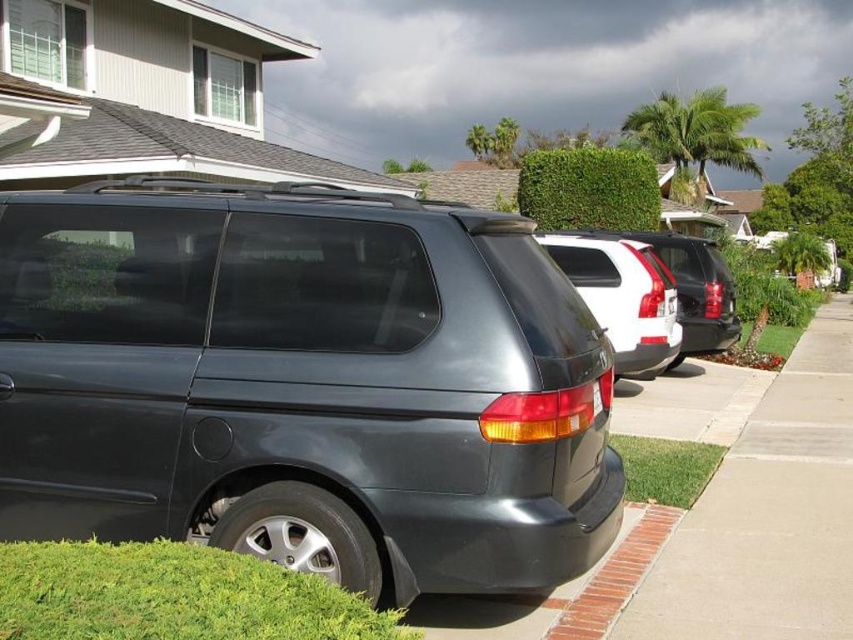
You are a delivery person standing at the sidewalk near the brick at lower right. You need to deliver a package to the white matte suv at center. Can you walk directly to the suv without crossing the street?

The white matte suv at center is 13.16 feet away from the brick at lower right. Since the sidewalk runs parallel to the street and the brick is part of the sidewalk border, you can walk directly to the white matte suv at center along the sidewalk without crossing the street.

You are a delivery person trying to park your white matte suv at center in a space between the brick at lower right and a fire hydrant. The fire hydrant is on the opposite side of the suv from the brick. Can the suv fit between them without touching either?

The white matte suv at center is much taller than the brick at lower right, but the question is about fitting between them horizontally, not vertically. The height difference doesn not indicate the distance between the brick and fire hydrant. Without knowing the suv length or space dimensions, we cannot determine if it will fit.

You are standing on the sidewalk and want to cross the street to reach the other side. The satin dark gray minivan at center is parked on the curb. If you walk straight ahead, will you have to go around the minivan to cross the street?

The satin dark gray minivan at center is parked on the curb, so if you walk straight ahead, you will have to go around the minivan to cross the street.